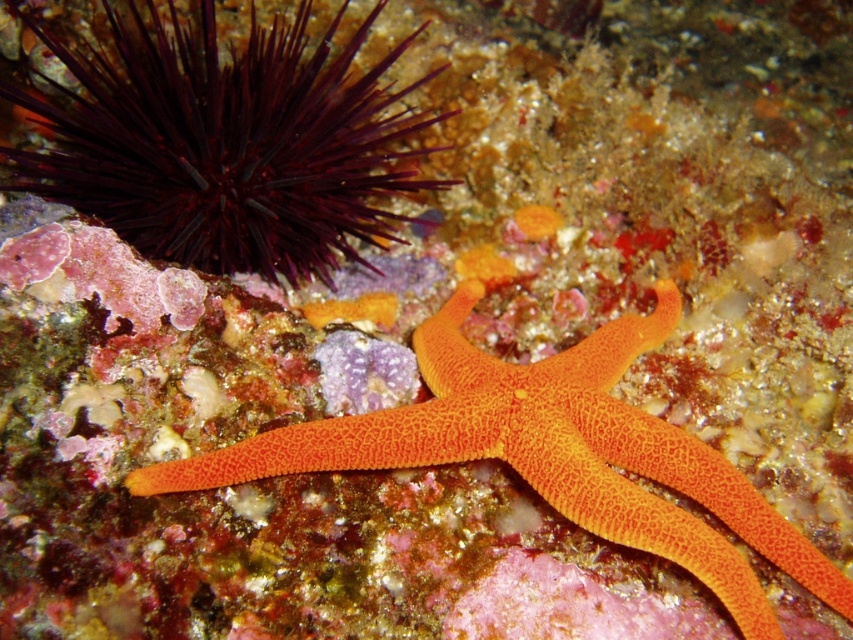
Where is `dark spiny sea urchin at upper left`? This screenshot has height=640, width=853. dark spiny sea urchin at upper left is located at coordinates (225, 144).

What do you see at coordinates (225, 144) in the screenshot? The width and height of the screenshot is (853, 640). I see `dark spiny sea urchin at upper left` at bounding box center [225, 144].

Identify the location of dark spiny sea urchin at upper left. (225, 144).